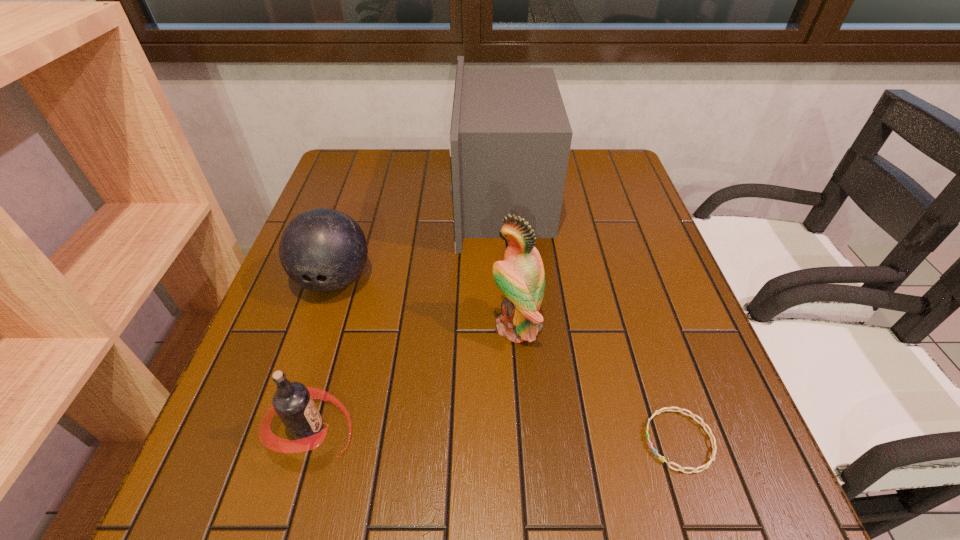
Find the location of a particular element. the farthest object is located at coordinates (510, 138).

Where is `parrot`? parrot is located at coordinates (520, 277).

Image resolution: width=960 pixels, height=540 pixels. I want to click on bowling ball, so click(323, 250).

I want to click on root beer, so click(293, 402).

Locate an element on the screen. The width and height of the screenshot is (960, 540). the shortest object is located at coordinates (705, 466).

Image resolution: width=960 pixels, height=540 pixels. I want to click on the rightmost object, so click(x=705, y=466).

You are a GUI agent. You are given a task and a screenshot of the screen. Output one action in this format:
    pyautogui.click(x=<x>, y=<y>)
    Task: Click on the free location located on the front-facing side of the farthest object
    The image size is (960, 540).
    Given the screenshot: What is the action you would take?
    pyautogui.click(x=347, y=197)

Where is `vacant space situated on the front-facing side of the farthest object`? vacant space situated on the front-facing side of the farthest object is located at coordinates (417, 197).

Identify the location of vacant space situated on the front-facing side of the farthest object. The image size is (960, 540). 435,197.

Find the location of a particular element. free space located 0.380m on the front-facing side of the parrot is located at coordinates (308, 327).